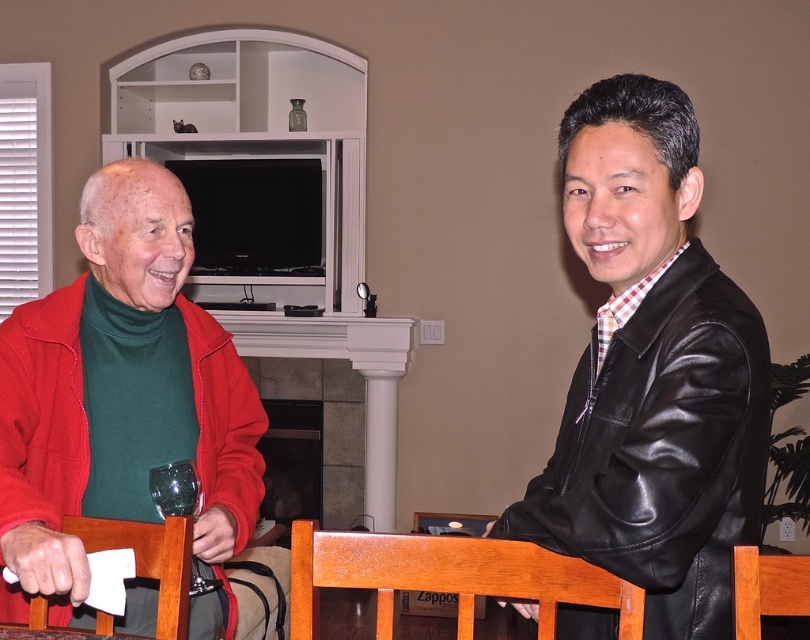
Is black leather jacket at right closer to camera compared to shiny green glass at lower left?

That is True.

Measure the distance from black leather jacket at right to shiny green glass at lower left.

A distance of 29.32 inches exists between black leather jacket at right and shiny green glass at lower left.

Between point (729, 586) and point (194, 472), which one is positioned in front?

Point (729, 586)

Identify the location of black leather jacket at right. (661, 445).

Measure the distance between point (254, 474) and camera.

Point (254, 474) is 1.77 meters away from camera.

Measure the distance between matte red jacket at left and camera.

A distance of 1.22 meters exists between matte red jacket at left and camera.

Does point (100, 202) come behind point (158, 499)?

Yes, point (100, 202) is behind point (158, 499).

You are a GUI agent. You are given a task and a screenshot of the screen. Output one action in this format:
    pyautogui.click(x=<x>, y=<y>)
    Task: Click on the matte red jacket at left
    This screenshot has width=810, height=640.
    Given the screenshot: What is the action you would take?
    pos(122,394)

Is point (41, 397) behind point (668, 547)?

Yes, it is behind point (668, 547).

Is matte red jacket at left bigger than black leather jacket at right?

Correct, matte red jacket at left is larger in size than black leather jacket at right.

Which is in front, point (75, 548) or point (671, 284)?

Point (75, 548) is in front.

The image size is (810, 640). I want to click on matte red jacket at left, so click(122, 394).